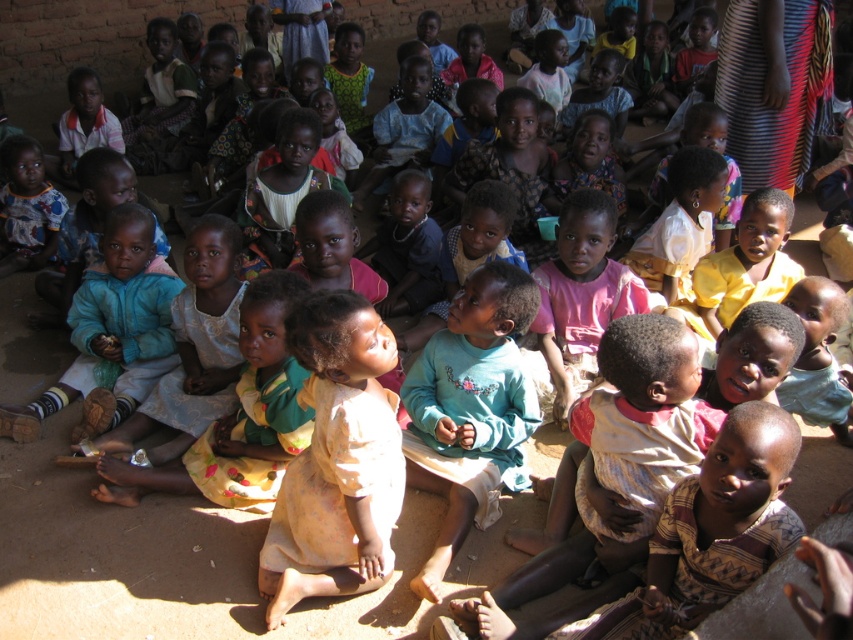
You are a photographer trying to capture a closeup of the light blue cotton shirt at center without including the light yellow fabric at center in the frame. Based on their positions, is this possible?

The light yellow fabric at center is positioned on the left side of the light blue cotton shirt at center. Therefore, moving the camera to the right side of the light blue cotton shirt at center would exclude the light yellow fabric at center from the frame.